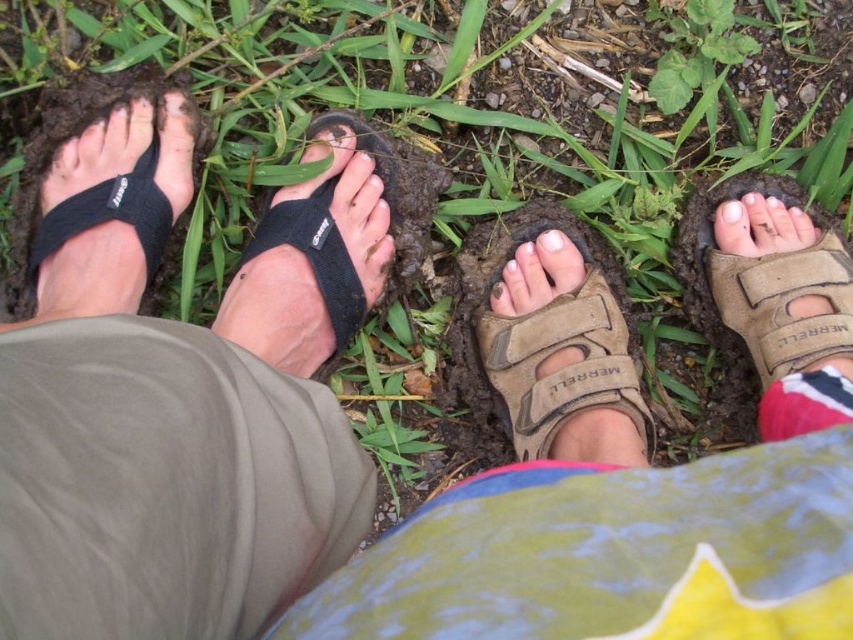
Question: Which point is farther to the camera?

Choices:
 (A) (511, 262)
 (B) (152, 104)
 (C) (740, 204)

Answer: (A)

Question: Does black fabric toe strap at left appear over matte brown sandal at center?

Choices:
 (A) yes
 (B) no

Answer: (A)

Question: Is the position of black fabric sandal at lower left more distant than that of tan suede sandal at center?

Choices:
 (A) no
 (B) yes

Answer: (B)

Question: Based on their relative distances, which object is farther from the tan suede sandal at center?

Choices:
 (A) white matte nail at center
 (B) black fabric sandal at lower left
 (C) matte black toe at center

Answer: (C)

Question: Can you confirm if black fabric toe strap at left is positioned to the left of matte black toe at center?

Choices:
 (A) no
 (B) yes

Answer: (B)

Question: Which point is closer to the camera?

Choices:
 (A) (54, 129)
 (B) (767, 292)
 (C) (578, 396)
 (D) (312, 156)

Answer: (C)